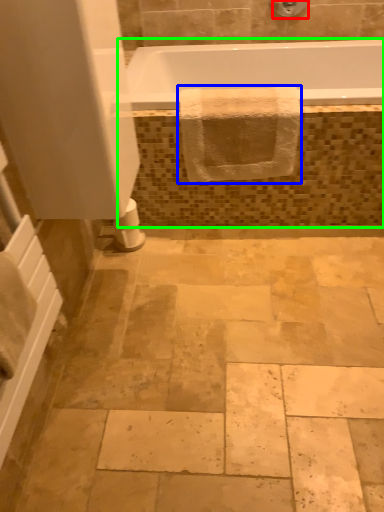
Question: Which is nearer to the shower (highlighted by a red box)? bath towel (highlighted by a blue box) or bath (highlighted by a green box).

Choices:
 (A) bath towel
 (B) bath

Answer: (A)